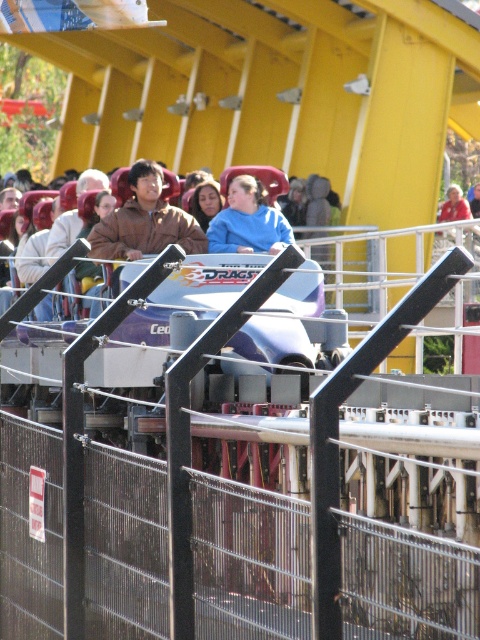
You are a photographer trying to capture a closeup of the brown leather jacket at center and the red shirt at center. Which object should you zoom in on to ensure both fit in the frame without cropping?

The brown leather jacket at center is wider than the red shirt at center, so you should zoom in on the red shirt at center to ensure both fit in the frame without cropping.

You are standing at the amusement park and see the roller coaster car labeled Drago. You also notice a point marked at coordinate (248,221). What is located at that point?

The point at (248,221) indicates a blue matte shirt at center.